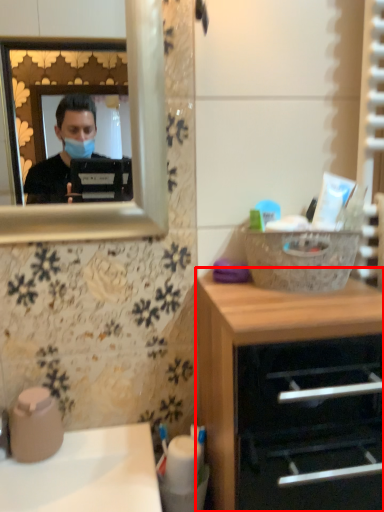
Question: From the image's perspective, considering the relative positions of chest of drawers (annotated by the red box) and sink in the image provided, where is chest of drawers (annotated by the red box) located with respect to the staircase?

Choices:
 (A) below
 (B) above

Answer: (B)